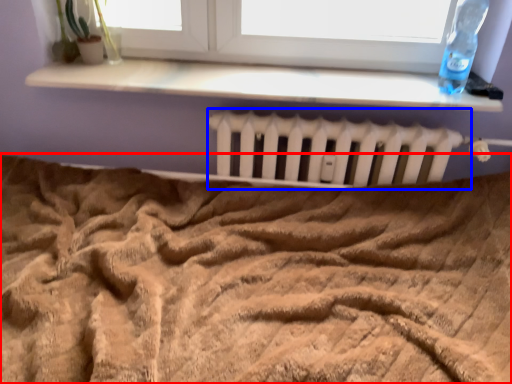
Question: Among these objects, which one is nearest to the camera, bed (highlighted by a red box) or radiator (highlighted by a blue box)?

Choices:
 (A) bed
 (B) radiator

Answer: (A)